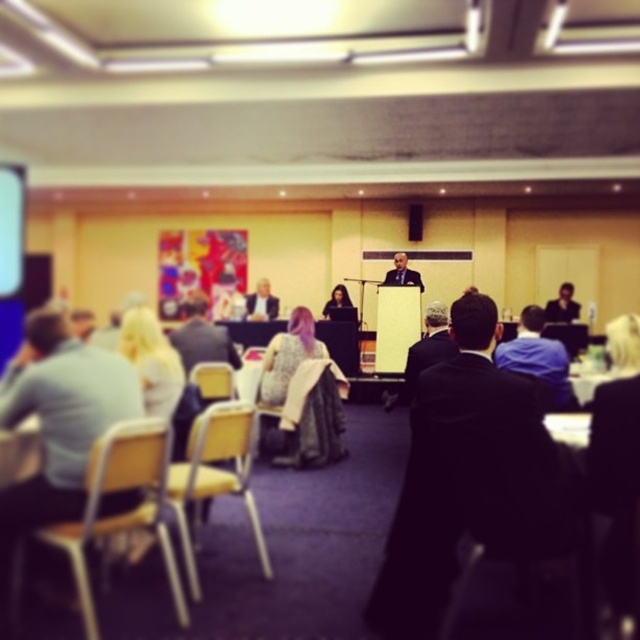
You are an event organizer setting up a presentation. You have a wooden chair at center and a yellow plastic chair at center. Which chair should you place higher up on the stage to ensure the speaker can reach the podium?

The wooden chair at center should be placed higher up on the stage because it is located below the yellow plastic chair at center, meaning the yellow plastic chair is already positioned higher and can be used for the speaker to reach the podium.

You are standing at the entrance of the conference room and want to sit in the wooden chair at center. According to the room layout, where should you walk towards?

The wooden chair at center is located at point 0.648 on the x axis and 0.491 on the y axis, so you should walk towards the center of the room to reach it.

You are organizing a small event and need to seat two guests. You have a yellow plastic chair at center and a smooth black suit at right. Which object is narrower? Please choose between the two.

The yellow plastic chair at center is narrower than the smooth black suit at right.